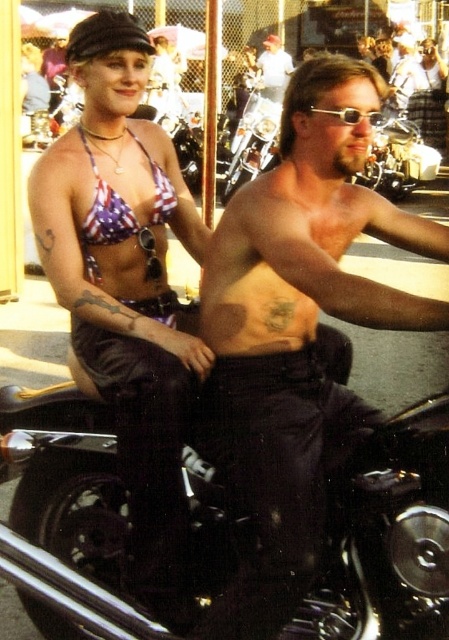
Is american flag bikini top at left smaller than sunglasses at center?

Correct, american flag bikini top at left occupies less space than sunglasses at center.

Is american flag bikini top at left positioned behind sunglasses at center?

Yes, american flag bikini top at left is behind sunglasses at center.

This screenshot has width=449, height=640. Identify the location of american flag bikini top at left. (126, 284).

You are a GUI agent. You are given a task and a screenshot of the screen. Output one action in this format:
    pyautogui.click(x=<x>, y=<y>)
    Task: Click on the american flag bikini top at left
    The width and height of the screenshot is (449, 640).
    Given the screenshot: What is the action you would take?
    pyautogui.click(x=126, y=284)

Which of these two, american flag fabric bikini top at upper left or sunglasses at center, stands shorter?

Standing shorter between the two is american flag fabric bikini top at upper left.

Describe the element at coordinates (123, 205) in the screenshot. I see `american flag fabric bikini top at upper left` at that location.

Where is `american flag fabric bikini top at upper left`? The width and height of the screenshot is (449, 640). american flag fabric bikini top at upper left is located at coordinates pos(123,205).

Between smooth white shirt at center and sunglasses at center, which one has more height?

sunglasses at center

Who is more distant from viewer, (271, 35) or (381, 120)?

The point (271, 35) is more distant.

Where is `smooth white shirt at center`? This screenshot has height=640, width=449. smooth white shirt at center is located at coordinates (273, 68).